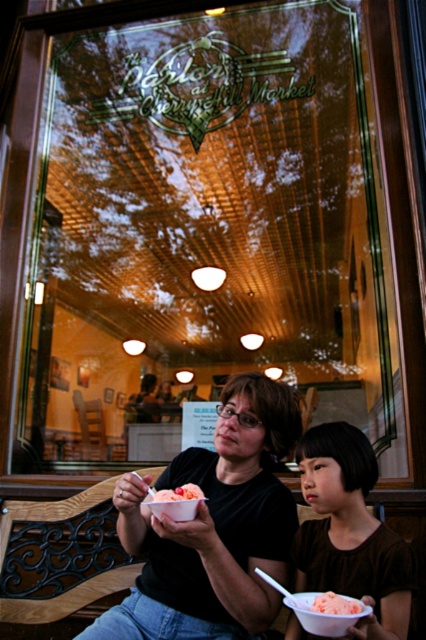
From the picture: Can you confirm if matte black shirt at center is thinner than pink ice cream at lower center?

No, matte black shirt at center is not thinner than pink ice cream at lower center.

Does matte black shirt at center have a lesser height compared to pink ice cream at lower center?

In fact, matte black shirt at center may be taller than pink ice cream at lower center.

Measure the distance between point (146, 608) and camera.

6.68 feet

Identify the location of matte black shirt at center. This screenshot has width=426, height=640. (213, 528).

Between matte black shirt at center and brown matte shirt at lower right, which one has more height?

With more height is matte black shirt at center.

Is matte black shirt at center positioned before brown matte shirt at lower right?

No.

Describe the element at coordinates (213, 528) in the screenshot. This screenshot has height=640, width=426. I see `matte black shirt at center` at that location.

Locate an element on the screen. This screenshot has width=426, height=640. matte black shirt at center is located at coordinates (213, 528).

Which is above, brown matte shirt at lower right or orange gelato at center?

orange gelato at center

Is brown matte shirt at lower right shorter than orange gelato at center?

No.

Between point (298, 625) and point (155, 493), which one is positioned behind?

Positioned behind is point (298, 625).

Find the location of a particular element. The width and height of the screenshot is (426, 640). brown matte shirt at lower right is located at coordinates (350, 531).